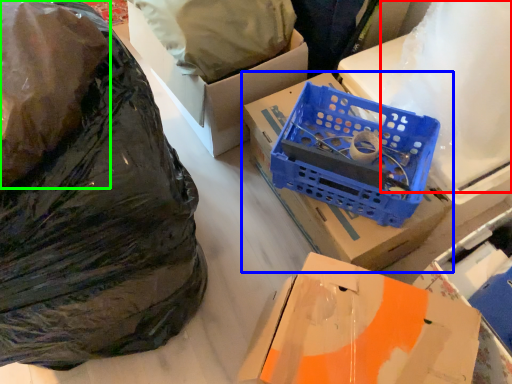
Question: Based on their relative distances, which object is farther from wrapping paper (highlighted by a red box)? Choose from box (highlighted by a blue box) and plastic bag (highlighted by a green box).

Choices:
 (A) box
 (B) plastic bag

Answer: (B)